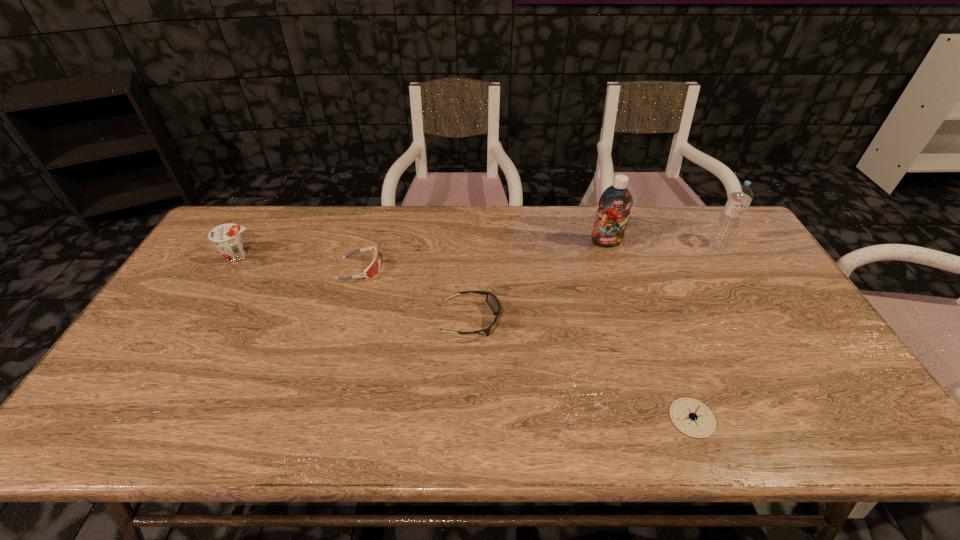
At what (x,y) coordinates should I click in order to perform the action: click on shampoo. Please return your answer as a coordinate pair (x, y). This screenshot has height=540, width=960. Looking at the image, I should click on (614, 204).

Image resolution: width=960 pixels, height=540 pixels. Find the location of `the rightmost object`. the rightmost object is located at coordinates tap(741, 196).

The width and height of the screenshot is (960, 540). Find the location of `yogurt`. yogurt is located at coordinates (226, 237).

Find the location of `the leftmost object`. the leftmost object is located at coordinates (x=226, y=237).

Where is `the left goggles`? the left goggles is located at coordinates (374, 267).

Locate an element on the screen. This screenshot has width=960, height=540. the farther goggles is located at coordinates (374, 267).

The image size is (960, 540). Find the location of `the fourth object from right to left`. the fourth object from right to left is located at coordinates (491, 299).

Where is `the right goggles`? The height and width of the screenshot is (540, 960). the right goggles is located at coordinates (491, 299).

This screenshot has width=960, height=540. In order to click on compass in this screenshot , I will do `click(692, 417)`.

At what (x,y) coordinates should I click in order to perform the action: click on vacant space situated 0.180m on the front label of the shampoo. Please return your answer as a coordinate pair (x, y). Image resolution: width=960 pixels, height=540 pixels. Looking at the image, I should click on (620, 287).